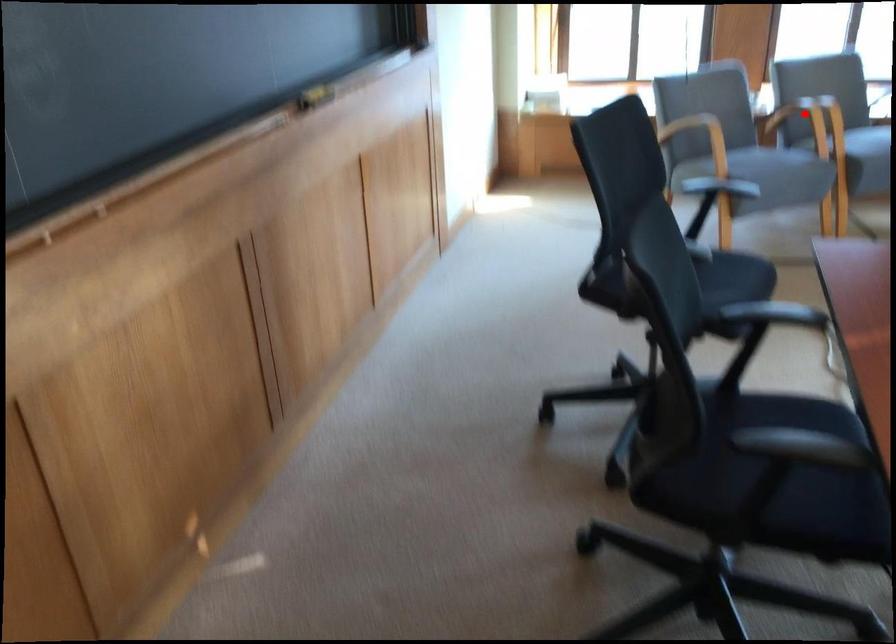
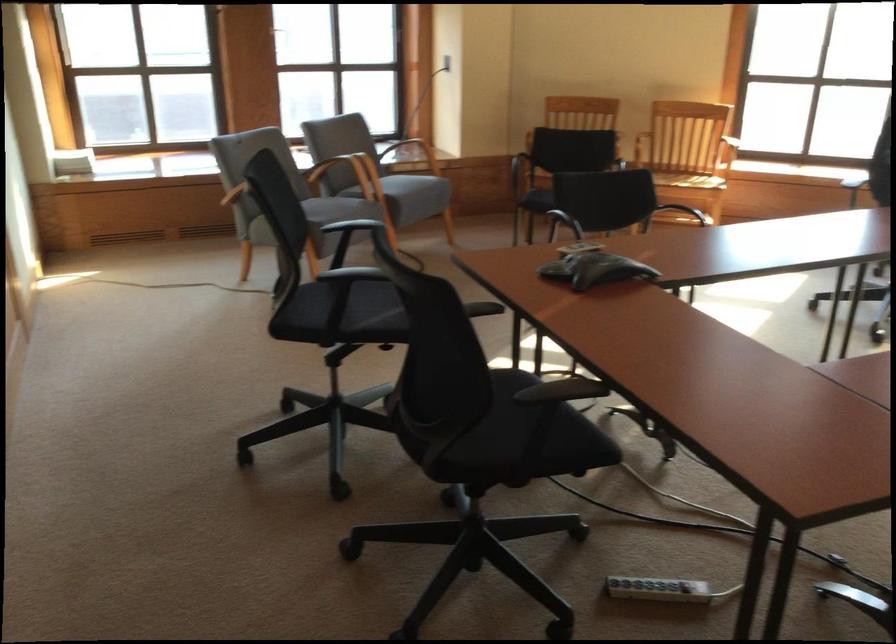
Locate, in the second image, the point that corresponds to the highlighted location in the first image.

(342, 172)